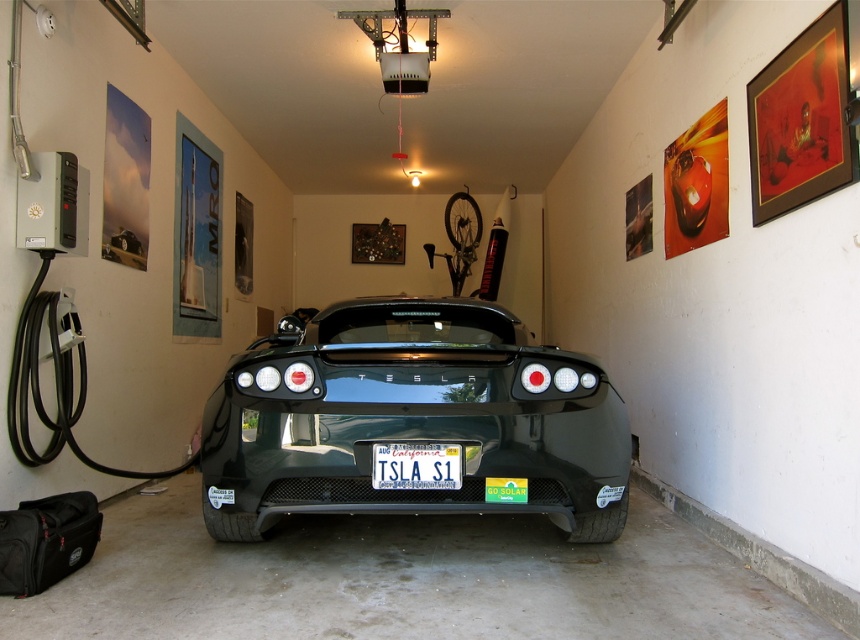
You are standing in the garage and want to move towards the shiny black Tesla at center. Based on its position coordinates, which direction should you move relative to your current position?

The shiny black Tesla at center is located at coordinates point (413, 419). Since the Tesla is at the center, you should move towards the center of the garage to reach it.

Consider the image. You are standing in the garage and want to place a small plant exactly at the point with coordinates (x=413, y=419). According to the image, where would this plant be placed?

The point (x=413, y=419) is on the shiny black tesla at center, so placing the plant there would put it on the car.

You are a delivery person trying to park a box in the garage. The box is 2 meters wide. Can the box fit between the shiny black tesla at center and the white plastic license plate at center?

The shiny black tesla at center is wider than the white plastic license plate at center. However, the question is about fitting a box between them. Since the Tesla is wider, the space between them might not be sufficient. But the description only mentions their widths, not the distance between them. Therefore, we cannot determine if the 2m wide box can fit based on the given information.